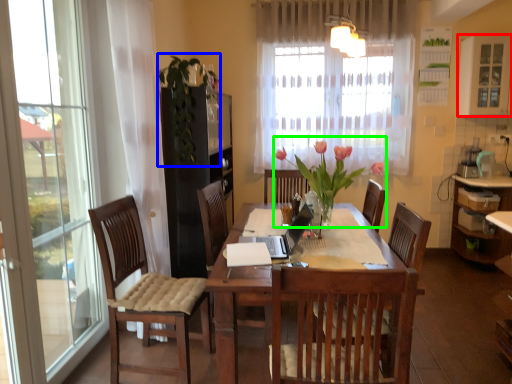
Question: Considering the real-world distances, which object is closest to window (highlighted by a red box)? floral arrangement (highlighted by a blue box) or floral arrangement (highlighted by a green box).

Choices:
 (A) floral arrangement
 (B) floral arrangement

Answer: (B)